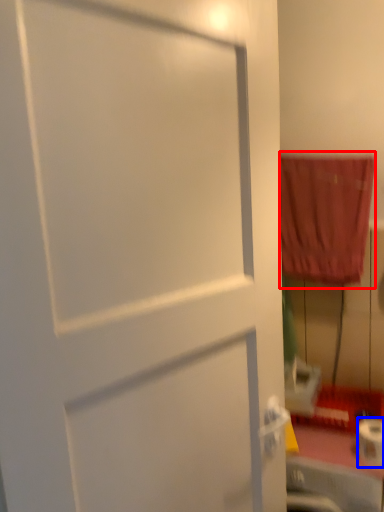
Question: Which object is closer to the camera taking this photo, curtain (highlighted by a red box) or toilet paper (highlighted by a blue box)?

Choices:
 (A) curtain
 (B) toilet paper

Answer: (B)